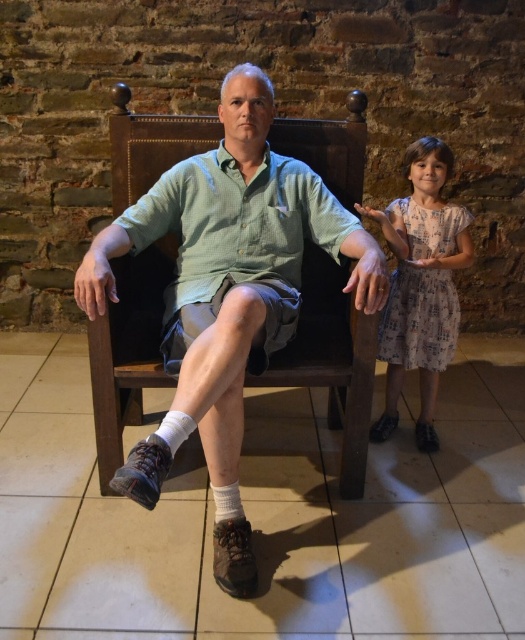
Question: Which of the following is the farthest from the observer?

Choices:
 (A) (244, 202)
 (B) (433, 193)

Answer: (B)

Question: Which point appears farthest from the camera in this image?

Choices:
 (A) (411, 252)
 (B) (261, 160)

Answer: (A)

Question: Can you confirm if green checkered shirt at center is thinner than dusty pink dress at right?

Choices:
 (A) yes
 (B) no

Answer: (B)

Question: From the image, what is the correct spatial relationship of green checkered shirt at center in relation to dusty pink dress at right?

Choices:
 (A) below
 (B) above

Answer: (A)

Question: Where is green checkered shirt at center located in relation to dusty pink dress at right in the image?

Choices:
 (A) left
 (B) right

Answer: (A)

Question: Among these objects, which one is nearest to the camera?

Choices:
 (A) green checkered shirt at center
 (B) dusty pink dress at right

Answer: (A)